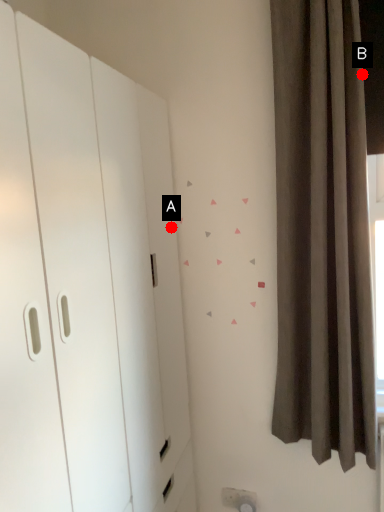
Question: Two points are circled on the image, labeled by A and B beside each circle. Which point is farther from the camera taking this photo?

Choices:
 (A) A is further
 (B) B is further

Answer: (A)